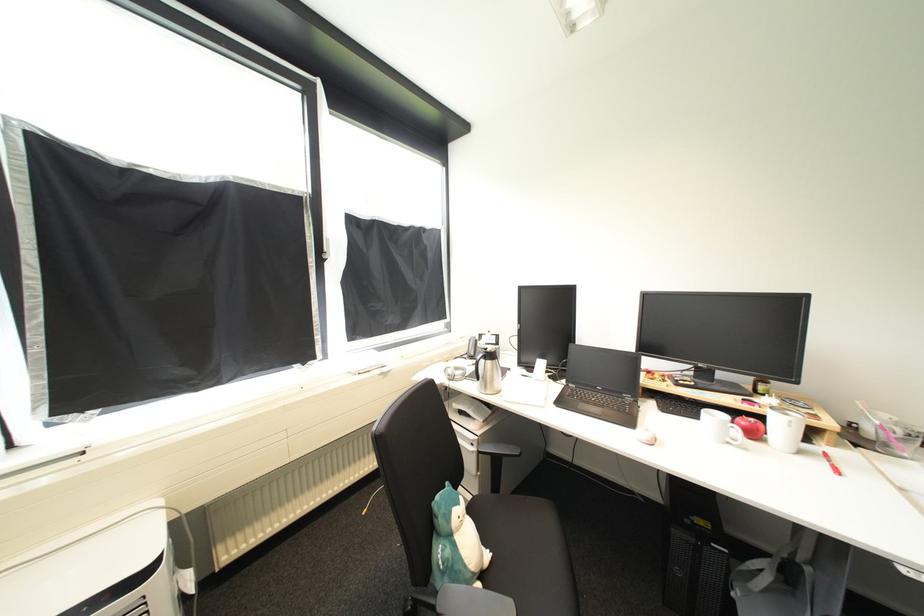
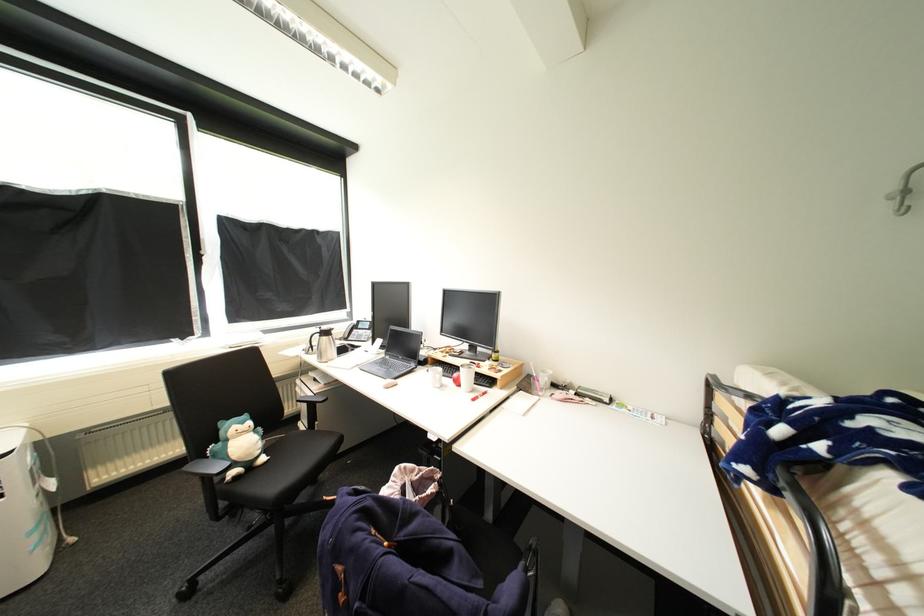
Where in the second image is the point corresponding to the point at 493,557 from the first image?

(270, 460)